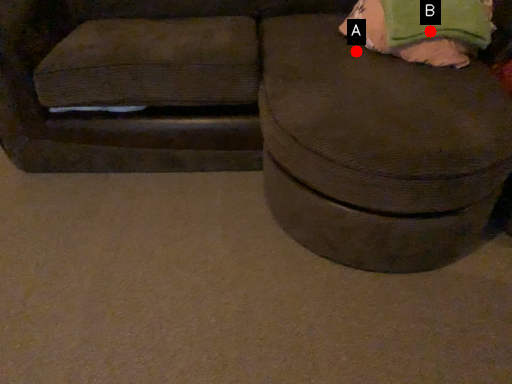
Question: Two points are circled on the image, labeled by A and B beside each circle. Which point is farther to the camera?

Choices:
 (A) A is further
 (B) B is further

Answer: (A)